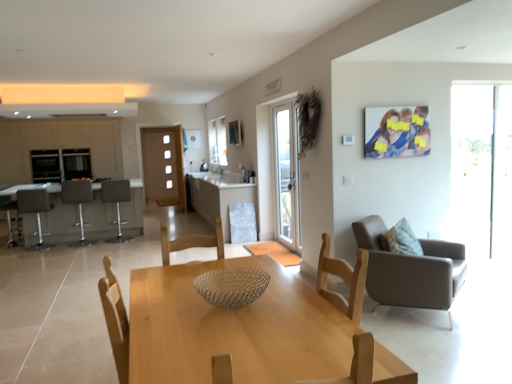
What is the approximate height of matte gray bar stool at left, the second chair in the front-to-back sequence?

It is 38.12 inches.

Where is `matte gray table at left, marked as the 1th table in a left-to-right arrangement`? The image size is (512, 384). matte gray table at left, marked as the 1th table in a left-to-right arrangement is located at coordinates (60, 218).

In order to face matte gray table at left, marked as the 1th table in a left-to-right arrangement, should I rotate leftwards or rightwards?

Rotate left and turn 22.602 degrees.

You are a GUI agent. You are given a task and a screenshot of the screen. Output one action in this format:
    pyautogui.click(x=<x>, y=<y>)
    Task: Click on the black glass oven at left
    
    Given the screenshot: What is the action you would take?
    [45, 166]

What is the approximate width of matte gray armchair at right, which is the fourth chair from left to right?

The width of matte gray armchair at right, which is the fourth chair from left to right, is 35.26 inches.

What is the approximate height of white marble table at center, which is the first table in right-to-left order?

white marble table at center, which is the first table in right-to-left order, is 38.79 inches tall.

The width and height of the screenshot is (512, 384). What are the coordinates of `matte plastic photo frame at upper right` in the screenshot? It's located at (397, 132).

At what (x,y) coordinates should I click in order to perform the action: click on exhaust hood in front of the black glass oven at left. Please return your answer as a coordinate pair (x, y). Image resolution: width=512 pixels, height=384 pixels. Looking at the image, I should click on (68, 110).

Between white glossy exhaust hood at upper center and black glass oven at left, which one has smaller width?

With smaller width is black glass oven at left.

Based on the photo, from the image's perspective, is white glossy exhaust hood at upper center positioned above or below black glass oven at left?

From the image's perspective, white glossy exhaust hood at upper center appears above black glass oven at left.

In the scene shown: Does white glass screen door at center have a lesser width compared to matte gray armchair at right, positioned as the 1th chair in front-to-back order?

Yes, white glass screen door at center is thinner than matte gray armchair at right, positioned as the 1th chair in front-to-back order.

Considering the relative positions of white glass screen door at center and matte gray armchair at right, which is the fourth chair from left to right, in the image provided, is white glass screen door at center behind matte gray armchair at right, which is the fourth chair from left to right,?

Yes, white glass screen door at center is further from the viewer.

Is white glass screen door at center inside or outside of matte gray armchair at right, positioned as the 1th chair in front-to-back order?

white glass screen door at center is not inside matte gray armchair at right, positioned as the 1th chair in front-to-back order, it's outside.

Is white glass screen door at center taller or shorter than matte gray armchair at right, which is the fourth chair from left to right?

In the image, white glass screen door at center appears to be taller than matte gray armchair at right, which is the fourth chair from left to right.

Is white marble table at center, which is the first table in right-to-left order, aimed at matte gray armchair at right, acting as the 4th chair starting from the back?

No, white marble table at center, which is the first table in right-to-left order, is not facing towards matte gray armchair at right, acting as the 4th chair starting from the back.

Is white marble table at center, which is the first table in right-to-left order, behind matte gray armchair at right, which is the fourth chair from left to right?

Yes.

Between white marble table at center, which ranks as the 2th table in left-to-right order, and matte gray armchair at right, positioned as the 1th chair in front-to-back order, which one has larger size?

white marble table at center, which ranks as the 2th table in left-to-right order, is bigger.

Is black glass oven at left far from matte plastic photo frame at upper right?

Yes, black glass oven at left is far from matte plastic photo frame at upper right.

From a real-world perspective, between black glass oven at left and matte plastic photo frame at upper right, who is vertically lower?

From a 3D spatial view, black glass oven at left is below.

Is matte plastic photo frame at upper right completely or partially inside black glass oven at left?

No, matte plastic photo frame at upper right is not a part of black glass oven at left.

Considering the positions of objects matte gray bar stool at left, which is the first chair in left-to-right order, and matte gray table at left, marked as the 1th table in a left-to-right arrangement, in the image provided, who is in front, matte gray bar stool at left, which is the first chair in left-to-right order, or matte gray table at left, marked as the 1th table in a left-to-right arrangement,?

matte gray bar stool at left, which is the first chair in left-to-right order.

Is point (42, 205) positioned behind point (33, 228)?

No, it is in front of (33, 228).

Is matte gray bar stool at left, which appears as the fourth chair when viewed from the right, facing away from matte gray table at left, which is counted as the second table, starting from the right?

Absolutely, matte gray bar stool at left, which appears as the fourth chair when viewed from the right, is directed away from matte gray table at left, which is counted as the second table, starting from the right.

Is matte gray bar stool at left, the second chair in the front-to-back sequence, with matte gray table at left, marked as the 1th table in a left-to-right arrangement?

No, matte gray bar stool at left, the second chair in the front-to-back sequence, is not with matte gray table at left, marked as the 1th table in a left-to-right arrangement.

In terms of size, does gray fabric bar stool at left, the second chair positioned from the right, appear bigger or smaller than black glass oven at left?

In the image, gray fabric bar stool at left, the second chair positioned from the right, appears to be larger than black glass oven at left.

From the image's perspective, who appears lower, gray fabric bar stool at left, acting as the 4th chair starting from the front, or black glass oven at left?

From the image's view, gray fabric bar stool at left, acting as the 4th chair starting from the front, is below.

Is gray fabric bar stool at left, marked as the 1th chair in a back-to-front arrangement, thinner than black glass oven at left?

No, gray fabric bar stool at left, marked as the 1th chair in a back-to-front arrangement, is not thinner than black glass oven at left.

This screenshot has height=384, width=512. Identify the location of the 1st chair in front of the black glass oven at left, counting from the anchor's position. (117, 203).

Where is `the 2nd table above the light wood table at center (from the image's perspective)`? This screenshot has width=512, height=384. the 2nd table above the light wood table at center (from the image's perspective) is located at coordinates (220, 196).

Considering the positions of points (249, 261) and (220, 210), is point (249, 261) farther from camera compared to point (220, 210)?

That is False.

Looking at this image, which object is closer to the camera, light wood table at center or white marble table at center, which ranks as the 2th table in left-to-right order?

light wood table at center is more forward.

From the image's perspective, is light wood table at center positioned above or below white marble table at center, which is the first table in right-to-left order?

Clearly, from the image's perspective, light wood table at center is below white marble table at center, which is the first table in right-to-left order.

The image size is (512, 384). Identify the location of appliance below the white glossy exhaust hood at upper center (from the image's perspective). (45, 166).

This screenshot has width=512, height=384. I want to click on chair in front of the white glass screen door at center, so click(x=410, y=270).

Looking at the image, which one is located further to light wood table at center, matte gray bar stool at left, the second chair from the back, or textured beige pillow at right?

matte gray bar stool at left, the second chair from the back, lies further to light wood table at center than the other object.

When comparing their distances from matte white cabinetry at left, does white marble table at center, which ranks as the 2th table in left-to-right order, or textured beige pillow at right seem closer?

white marble table at center, which ranks as the 2th table in left-to-right order, is positioned closer to the anchor matte white cabinetry at left.

Based on their spatial positions, is matte gray table at left, which is counted as the second table, starting from the right, or textured beige pillow at right further from matte gray bar stool at left, which appears as the fourth chair when viewed from the right?

The object further to matte gray bar stool at left, which appears as the fourth chair when viewed from the right, is textured beige pillow at right.

Looking at the image, which one is located closer to transparent glass door at right, matte gray bar stool at left, the 3th chair viewed from the front, or textured beige pillow at right?

Based on the image, textured beige pillow at right appears to be nearer to transparent glass door at right.

Looking at the image, which one is located further to matte gray armchair at right, which is the fourth chair from left to right, gray fabric bar stool at left, marked as the 1th chair in a back-to-front arrangement, or white glass screen door at center?

Among the two, gray fabric bar stool at left, marked as the 1th chair in a back-to-front arrangement, is located further to matte gray armchair at right, which is the fourth chair from left to right.

Considering their positions, is matte gray armchair at right, acting as the 4th chair starting from the back, positioned further to black glass oven at left than transparent glass door at right?

The object further to black glass oven at left is transparent glass door at right.

From the image, which object appears to be farther from matte plastic photo frame at upper right, white marble table at center, which is the first table in right-to-left order, or matte white cabinetry at left?

matte white cabinetry at left lies further to matte plastic photo frame at upper right than the other object.

Based on their spatial positions, is textured beige pillow at right or matte plastic photo frame at upper right closer to white glossy exhaust hood at upper center?

matte plastic photo frame at upper right.

Locate an element on the screen. screen door between matte white cabinetry at left and matte gray armchair at right, which is the fourth chair from left to right, in the horizontal direction is located at coordinates (287, 174).

Where is `pillow positioned between light wood table at center and matte gray table at left, which is counted as the second table, starting from the right, from near to far`? The height and width of the screenshot is (384, 512). pillow positioned between light wood table at center and matte gray table at left, which is counted as the second table, starting from the right, from near to far is located at coordinates (401, 239).

This screenshot has height=384, width=512. In order to click on screen door between light wood table at center and matte gray table at left, marked as the 1th table in a left-to-right arrangement, in the front-back direction in this screenshot , I will do `click(287, 174)`.

Where is `screen door between light wood table at center and matte white cabinetry at left in the front-back direction`? Image resolution: width=512 pixels, height=384 pixels. screen door between light wood table at center and matte white cabinetry at left in the front-back direction is located at coordinates (287, 174).